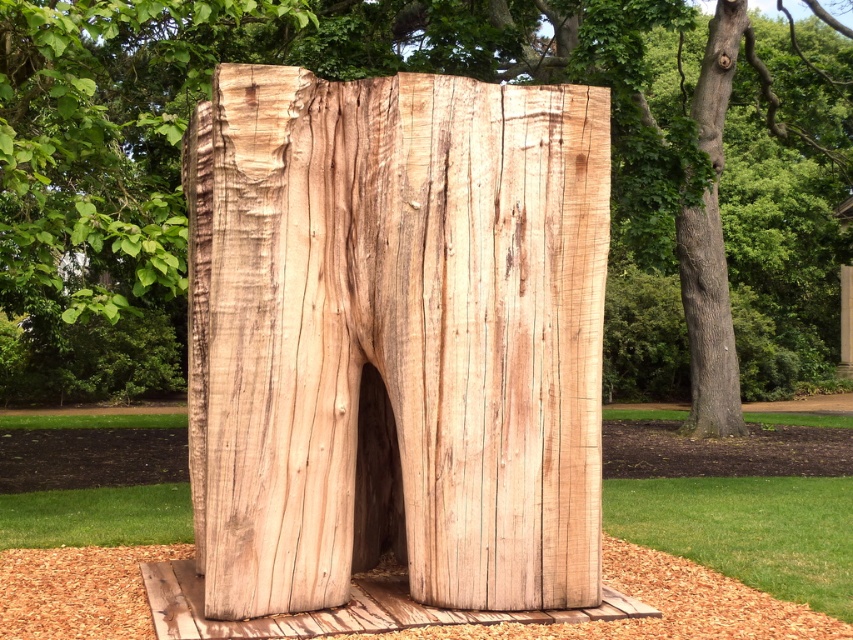
You are standing in front of the wooden sculpture and want to know which of the two points, point (311, 346) or point (822, 305), is closer to your viewpoint. Can you determine this based on the sculpture?

Point (311, 346) is closer to the camera than point (822, 305), so it is closer to your viewpoint.

Looking at this image, you are an artist planning to install a new sculpture in a park. You have two options to choose from the image. Which one is shorter between the natural wood sculpture at center and the natural wood tree trunk at right?

The natural wood sculpture at center is shorter than the natural wood tree trunk at right.

You are an artist examining the natural wood sculpture at center and the natural wood tree trunk at center in the park. Which object is positioned lower in the scene?

The natural wood sculpture at center is located below the natural wood tree trunk at center, so it is positioned lower in the scene.